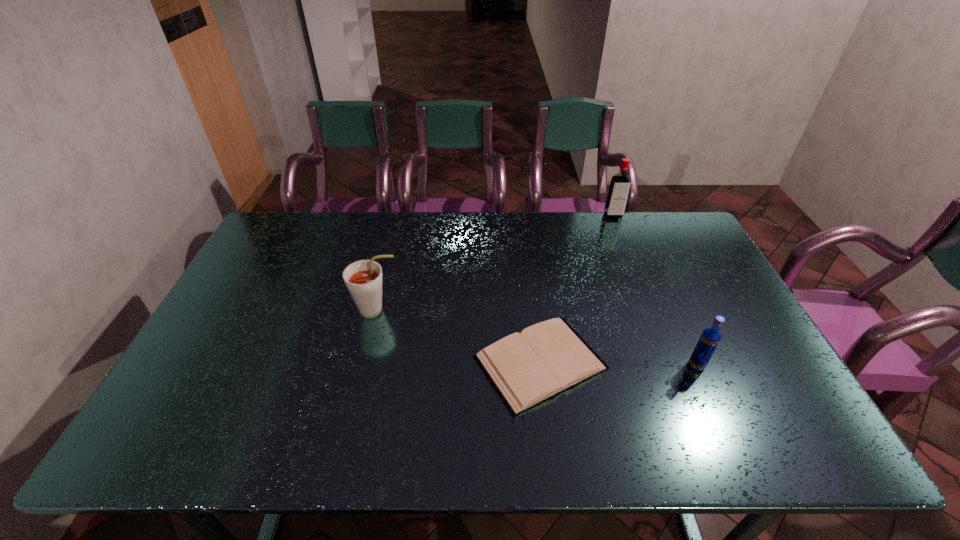
I want to click on free space that satisfies the following two spatial constraints: 1. on the drink side of the leftmost object; 2. on the back side of the hardback book, so click(364, 362).

Where is `vacant space that satisfies the following two spatial constraints: 1. on the front and back of the nearer vodka; 2. on the left side of the second object from right to left`? vacant space that satisfies the following two spatial constraints: 1. on the front and back of the nearer vodka; 2. on the left side of the second object from right to left is located at coordinates (673, 365).

At what (x,y) coordinates should I click in order to perform the action: click on free spot that satisfies the following two spatial constraints: 1. on the drink side of the root beer; 2. on the right side of the shortest object. Please return your answer as a coordinate pair (x, y). Looking at the image, I should click on (364, 362).

You are a GUI agent. You are given a task and a screenshot of the screen. Output one action in this format:
    pyautogui.click(x=<x>, y=<y>)
    Task: Click on the free region that satisfies the following two spatial constraints: 1. on the front and back of the third object from left to right; 2. on the left side of the rightmost object
    
    Given the screenshot: What is the action you would take?
    click(x=673, y=365)

You are a GUI agent. You are given a task and a screenshot of the screen. Output one action in this format:
    pyautogui.click(x=<x>, y=<y>)
    Task: Click on the free point that satisfies the following two spatial constraints: 1. on the drink side of the leftmost object; 2. on the left side of the second object from left to right
    This screenshot has width=960, height=540.
    Given the screenshot: What is the action you would take?
    (x=364, y=362)

Where is `free space that satisfies the following two spatial constraints: 1. on the drink side of the root beer; 2. on the left side of the second object from left to right`? The image size is (960, 540). free space that satisfies the following two spatial constraints: 1. on the drink side of the root beer; 2. on the left side of the second object from left to right is located at coordinates (364, 362).

The width and height of the screenshot is (960, 540). I want to click on vacant area that satisfies the following two spatial constraints: 1. on the drink side of the shorter vodka; 2. on the right side of the root beer, so click(x=364, y=365).

Where is `vacant position in the image that satisfies the following two spatial constraints: 1. on the drink side of the root beer; 2. on the back side of the third object from right to left`? vacant position in the image that satisfies the following two spatial constraints: 1. on the drink side of the root beer; 2. on the back side of the third object from right to left is located at coordinates (364, 362).

The height and width of the screenshot is (540, 960). Find the location of `vacant region that satisfies the following two spatial constraints: 1. on the drink side of the leftmost object; 2. on the right side of the right vodka`. vacant region that satisfies the following two spatial constraints: 1. on the drink side of the leftmost object; 2. on the right side of the right vodka is located at coordinates (364, 365).

This screenshot has height=540, width=960. Identify the location of vacant area in the image that satisfies the following two spatial constraints: 1. on the front side of the rightmost object; 2. on the left side of the second object from left to right. (540, 365).